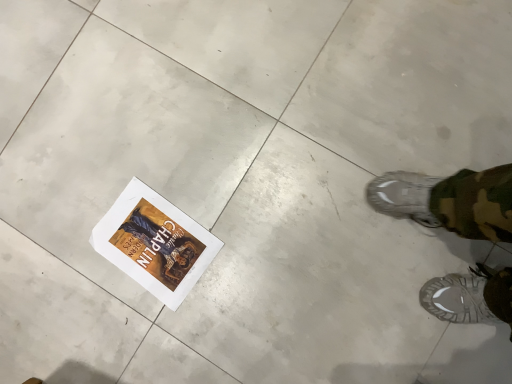
This screenshot has height=384, width=512. Identify the location of vacant area on the back side of white paper postcard at lower left. 86,162.